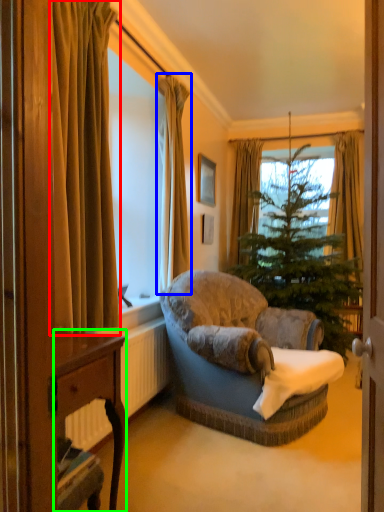
Question: Estimate the real-world distances between objects in this image. Which object is farther from curtain (highlighted by a red box), curtain (highlighted by a blue box) or desk (highlighted by a green box)?

Choices:
 (A) curtain
 (B) desk

Answer: (A)